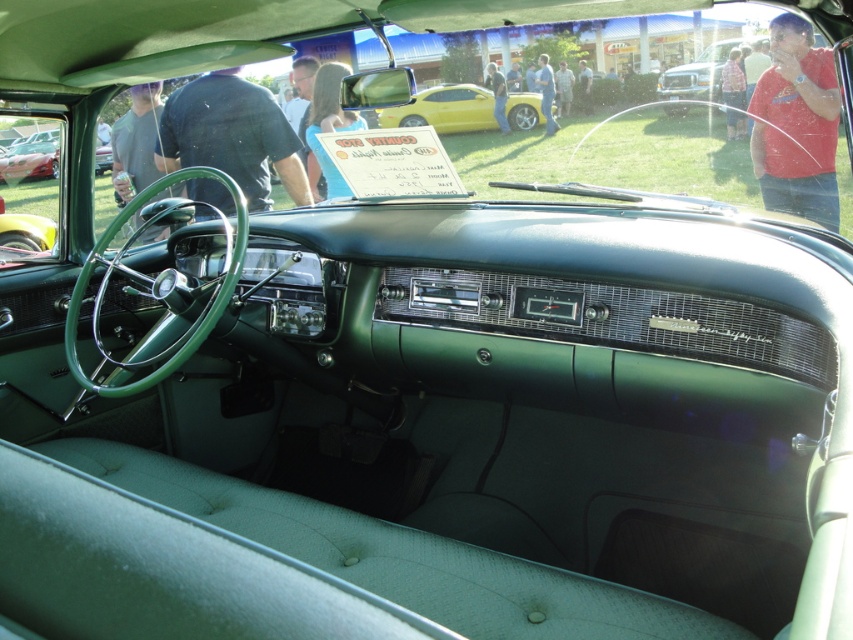
You are standing 10 meters away from a yellow metallic car at center. Can you safely walk towards it without getting too close?

The yellow metallic car at center is 11.33 meters away from the viewer, so walking towards it from 10 meters away would bring you closer than the current distance. However, since 10 meters is already within the 11.33 meters distance, you are already closer than the stated distance. Therefore, you can safely approach it as you are already within that range.

You are a delivery driver who needs to enter a low clearance tunnel. You see a yellow metallic car at center and a metallic silver truck at upper center in the image. Which vehicle should you avoid to ensure you don not hit the tunnel ceiling?

The yellow metallic car at center is taller than the metallic silver truck at upper center, so you should avoid the yellow metallic car at center to prevent hitting the tunnel ceiling.

You are standing outside a car dealership and see the yellow metallic car at center and the metallic silver truck at upper center. Which vehicle is positioned to the left side from your perspective?

The yellow metallic car at center is positioned to the left of the metallic silver truck at upper center.